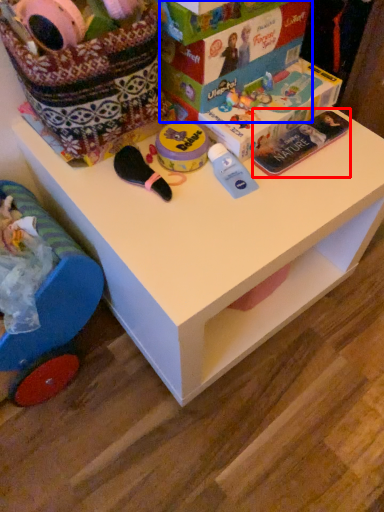
Question: Which object is closer to the camera taking this photo, magazine (highlighted by a red box) or storage box (highlighted by a blue box)?

Choices:
 (A) magazine
 (B) storage box

Answer: (B)